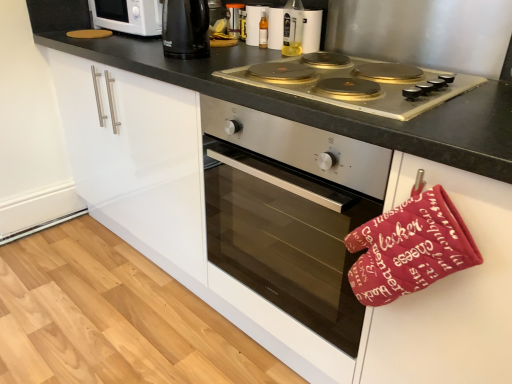
I want to click on gold-coated stovetop at center, so click(357, 83).

This screenshot has width=512, height=384. Describe the element at coordinates (357, 83) in the screenshot. I see `gold-coated stovetop at center` at that location.

You are a GUI agent. You are given a task and a screenshot of the screen. Output one action in this format:
    pyautogui.click(x=<x>, y=<y>)
    Task: Click on the white glossy oven at center
    The height and width of the screenshot is (384, 512).
    Given the screenshot: What is the action you would take?
    pyautogui.click(x=448, y=294)

What do you see at coordinates (263, 31) in the screenshot? I see `translucent glass bottle at center, which appears as the 2th bottle when viewed from the front` at bounding box center [263, 31].

What do you see at coordinates (290, 213) in the screenshot?
I see `stainless steel oven at center` at bounding box center [290, 213].

You are a GUI agent. You are given a task and a screenshot of the screen. Output one action in this format:
    pyautogui.click(x=<x>, y=<y>)
    Task: Click on the gold-coated stovetop at center
    The height and width of the screenshot is (384, 512).
    Given the screenshot: What is the action you would take?
    pyautogui.click(x=357, y=83)

Can we say white glossy microwave at upper left lies outside stainless steel oven at center?

white glossy microwave at upper left lies outside stainless steel oven at center's area.

Is white glossy microwave at upper left next to stainless steel oven at center and touching it?

No, white glossy microwave at upper left is not making contact with stainless steel oven at center.

Is white glossy microwave at upper left bigger or smaller than stainless steel oven at center?

Clearly, white glossy microwave at upper left is smaller in size than stainless steel oven at center.

Looking at this image, between white glossy microwave at upper left and stainless steel oven at center, which one appears on the right side from the viewer's perspective?

stainless steel oven at center.

Is stainless steel oven at center positioned far away from gold-coated stovetop at center?

That's not correct — stainless steel oven at center is a little close to gold-coated stovetop at center.

Is stainless steel oven at center located outside gold-coated stovetop at center?

That's correct, stainless steel oven at center is outside of gold-coated stovetop at center.

You are a GUI agent. You are given a task and a screenshot of the screen. Output one action in this format:
    pyautogui.click(x=<x>, y=<y>)
    Task: Click on the oven lying in front of the gold-coated stovetop at center
    This screenshot has height=384, width=512.
    Given the screenshot: What is the action you would take?
    pyautogui.click(x=290, y=213)

From a real-world perspective, is stainless steel oven at center physically located above or below gold-coated stovetop at center?

Clearly, from a real-world perspective, stainless steel oven at center is below gold-coated stovetop at center.

Is translucent plastic bottle at upper center, the 1th bottle in the front-to-back sequence, smaller than translucent glass bottle at center, acting as the 2th bottle starting from the right?

No, translucent plastic bottle at upper center, the 1th bottle in the front-to-back sequence, is not smaller than translucent glass bottle at center, acting as the 2th bottle starting from the right.

Between translucent plastic bottle at upper center, the 1th bottle in the front-to-back sequence, and translucent glass bottle at center, acting as the 2th bottle starting from the right, which one has less height?

Standing shorter between the two is translucent glass bottle at center, acting as the 2th bottle starting from the right.

How much distance is there between translucent plastic bottle at upper center, the 1th bottle in the front-to-back sequence, and translucent glass bottle at center, acting as the 2th bottle starting from the right?

translucent plastic bottle at upper center, the 1th bottle in the front-to-back sequence, is 4.94 inches from translucent glass bottle at center, acting as the 2th bottle starting from the right.

Can you tell me how much translucent plastic bottle at upper center, which ranks as the 2th bottle in back-to-front order, and translucent glass bottle at center, the 1th bottle positioned from the left, differ in facing direction?

2.55 degrees separate the facing orientations of translucent plastic bottle at upper center, which ranks as the 2th bottle in back-to-front order, and translucent glass bottle at center, the 1th bottle positioned from the left.

Who is more distant, translucent glass bottle at center, the 1th bottle positioned from the left, or black plastic kettle at upper center?

translucent glass bottle at center, the 1th bottle positioned from the left.

Considering the relative positions of translucent glass bottle at center, marked as the first bottle in a back-to-front arrangement, and black plastic kettle at upper center in the image provided, is translucent glass bottle at center, marked as the first bottle in a back-to-front arrangement, to the left of black plastic kettle at upper center from the viewer's perspective?

Incorrect, translucent glass bottle at center, marked as the first bottle in a back-to-front arrangement, is not on the left side of black plastic kettle at upper center.

Is translucent glass bottle at center, the 1th bottle positioned from the left, not near black plastic kettle at upper center?

No.

From the image's perspective, which is above, translucent glass bottle at center, the 1th bottle positioned from the left, or black plastic kettle at upper center?

translucent glass bottle at center, the 1th bottle positioned from the left, from the image's perspective.

In the scene shown: From the image's perspective, who appears lower, white glossy microwave at upper left or gold-coated stovetop at center?

gold-coated stovetop at center appears lower in the image.

Is white glossy microwave at upper left in front of or behind gold-coated stovetop at center in the image?

white glossy microwave at upper left is positioned farther from the viewer than gold-coated stovetop at center.

Is point (142, 11) closer to viewer compared to point (348, 73)?

That is False.

Which object is thinner, white glossy microwave at upper left or gold-coated stovetop at center?

With smaller width is white glossy microwave at upper left.

How many degrees apart are the facing directions of translucent glass bottle at center, the 1th bottle positioned from the left, and stainless steel oven at center?

The angular difference between translucent glass bottle at center, the 1th bottle positioned from the left, and stainless steel oven at center is 0.876 degrees.

From a real-world perspective, starting from the stainless steel oven at center, which bottle is the 1st one vertically above it? Please provide its 2D coordinates.

[(263, 31)]

Consider the image. In terms of height, does translucent glass bottle at center, which appears as the 2th bottle when viewed from the front, look taller or shorter compared to stainless steel oven at center?

In the image, translucent glass bottle at center, which appears as the 2th bottle when viewed from the front, appears to be shorter than stainless steel oven at center.

Is translucent glass bottle at center, marked as the first bottle in a back-to-front arrangement, not inside stainless steel oven at center?

Yes, translucent glass bottle at center, marked as the first bottle in a back-to-front arrangement, is outside of stainless steel oven at center.

Is gold-coated stovetop at center positioned behind stainless steel oven at center?

Yes, the depth of gold-coated stovetop at center is greater than that of stainless steel oven at center.

In the scene shown: Could you tell me if gold-coated stovetop at center is turned towards stainless steel oven at center?

No, gold-coated stovetop at center is not oriented towards stainless steel oven at center.

What's the angular difference between gold-coated stovetop at center and stainless steel oven at center's facing directions?

The angular difference between gold-coated stovetop at center and stainless steel oven at center is 0.931 degrees.

You are a GUI agent. You are given a task and a screenshot of the screen. Output one action in this format:
    pyautogui.click(x=<x>, y=<y>)
    Task: Click on the oven directly beneath the white glossy microwave at upper left (from a real-world perspective)
    
    Given the screenshot: What is the action you would take?
    tap(290, 213)

This screenshot has width=512, height=384. What are the coordinates of `gas stove behind the stainless steel oven at center` in the screenshot? It's located at (357, 83).

Based on their spatial positions, is translucent glass bottle at center, marked as the first bottle in a back-to-front arrangement, or stainless steel oven at center further from white glossy microwave at upper left?

The object further to white glossy microwave at upper left is stainless steel oven at center.

Based on their spatial positions, is translucent glass bottle at upper center or gold-coated stovetop at center closer to translucent plastic bottle at upper center, which ranks as the 2th bottle in back-to-front order?

translucent glass bottle at upper center.

Considering their positions, is translucent plastic bottle at upper center, which is the second bottle from left to right, positioned closer to translucent glass bottle at upper center than black plastic kettle at upper center?

translucent plastic bottle at upper center, which is the second bottle from left to right, is positioned closer to the anchor translucent glass bottle at upper center.

Looking at the image, which one is located closer to white glossy microwave at upper left, stainless steel oven at center or white glossy oven at center?

Among the two, stainless steel oven at center is located nearer to white glossy microwave at upper left.

From the image, which object appears to be farther from translucent glass bottle at center, the 1th bottle positioned from the left, black plastic kettle at upper center or white glossy microwave at upper left?

white glossy microwave at upper left is positioned further to the anchor translucent glass bottle at center, the 1th bottle positioned from the left.

When comparing their distances from black plastic kettle at upper center, does stainless steel oven at center or gold-coated stovetop at center seem further?

Based on the image, stainless steel oven at center appears to be further to black plastic kettle at upper center.

Looking at the image, which one is located further to gold-coated stovetop at center, black plastic kettle at upper center or translucent glass bottle at center, the 1th bottle positioned from the left?

translucent glass bottle at center, the 1th bottle positioned from the left, is positioned further to the anchor gold-coated stovetop at center.

From the image, which object appears to be nearer to translucent glass bottle at center, acting as the 2th bottle starting from the right, white glossy oven at center or stainless steel oven at center?

The object closer to translucent glass bottle at center, acting as the 2th bottle starting from the right, is stainless steel oven at center.

Where is `oven between translucent plastic bottle at upper center, the 1th bottle in the front-to-back sequence, and white glossy oven at center, in the vertical direction`? This screenshot has width=512, height=384. oven between translucent plastic bottle at upper center, the 1th bottle in the front-to-back sequence, and white glossy oven at center, in the vertical direction is located at coordinates (290, 213).

I want to click on gas stove between stainless steel oven at center and translucent glass bottle at center, the 1th bottle positioned from the left, from front to back, so click(357, 83).

You are a GUI agent. You are given a task and a screenshot of the screen. Output one action in this format:
    pyautogui.click(x=<x>, y=<y>)
    Task: Click on the appliance between gold-coated stovetop at center and white glossy microwave at upper left along the z-axis
    This screenshot has height=384, width=512.
    Given the screenshot: What is the action you would take?
    pyautogui.click(x=253, y=23)

Find the location of a particular element. gas stove located between stainless steel oven at center and translucent plastic bottle at upper center, which is the 1th bottle in right-to-left order, in the depth direction is located at coordinates (357, 83).